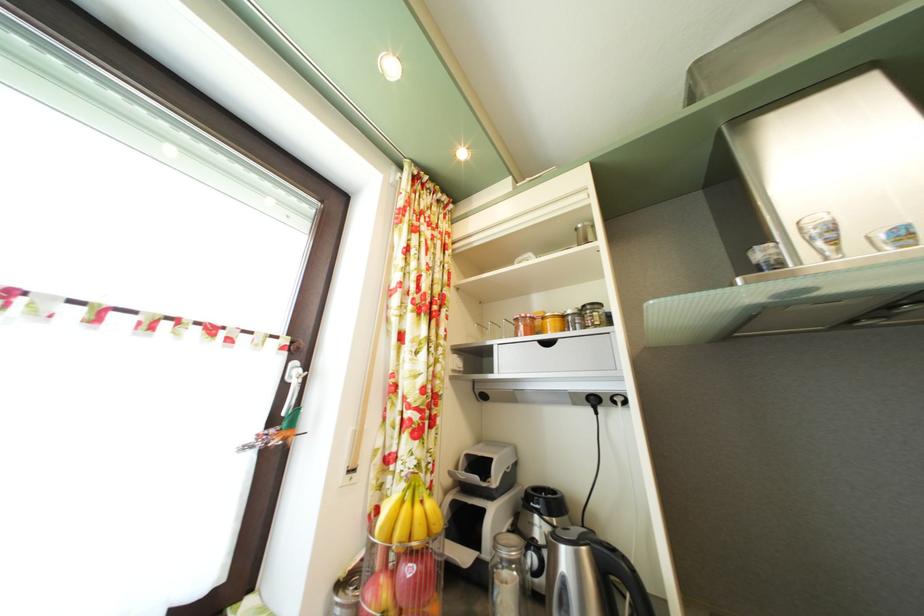
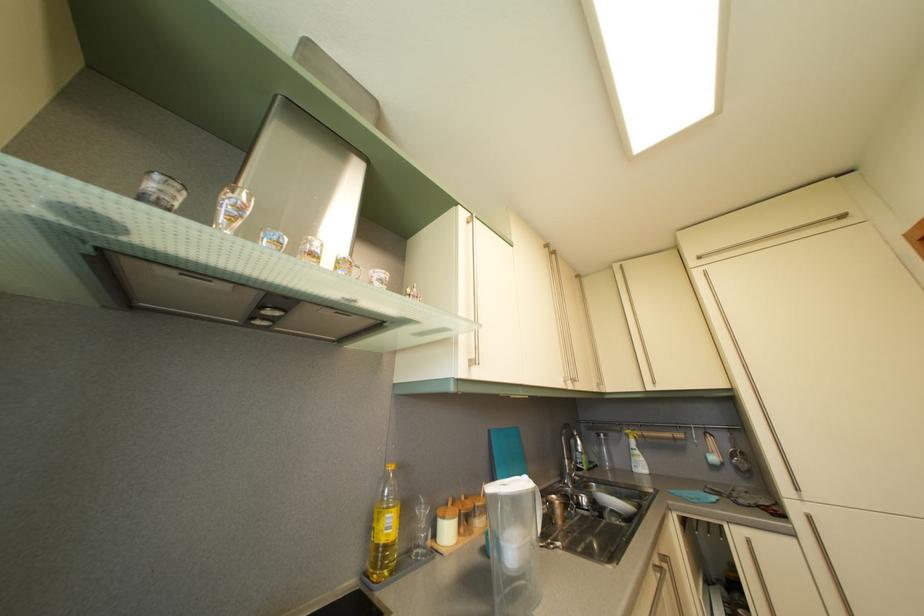
In the second image, find the point that corresponds to the point at 862,329 in the first image.

(261, 326)